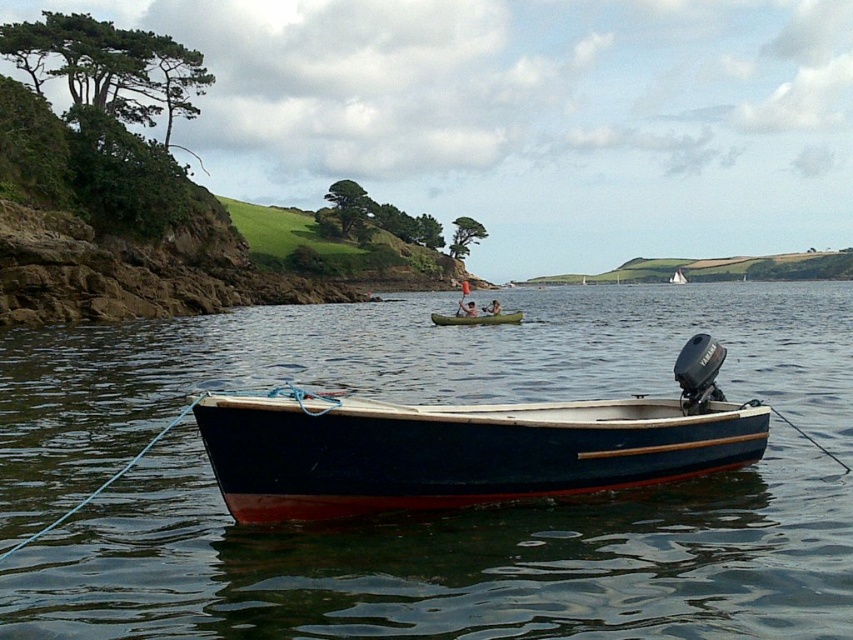
You are standing on the shore and see the green plastic canoe at center. Which direction should you look to find the boat that is closer to the shore?

The green plastic canoe at center is located at point (476, 317), so you should look towards the direction of the boat that is closer to the shore, which would be the dark blue wooden rowboat with red bottom and small outboard motor at the foreground.

You are standing on the shore and looking at the smooth dark blue water at center and the dark blue polished wood boat at center. Which one appears higher in the scene?

The smooth dark blue water at center appears higher than the dark blue polished wood boat at center because it is taller in the scene.

You are standing on the shore looking out at the water. You see the green plastic canoe at center and the smooth white kayak at center. Which one is closer to the water surface?

The green plastic canoe at center is located below the smooth white kayak at center, so it is closer to the water surface.